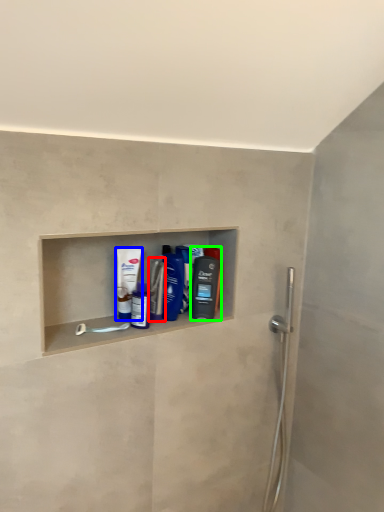
Question: Which is farther away from mouthwash (highlighted by a red box)? mouthwash (highlighted by a blue box) or mouthwash (highlighted by a green box)?

Choices:
 (A) mouthwash
 (B) mouthwash

Answer: (B)